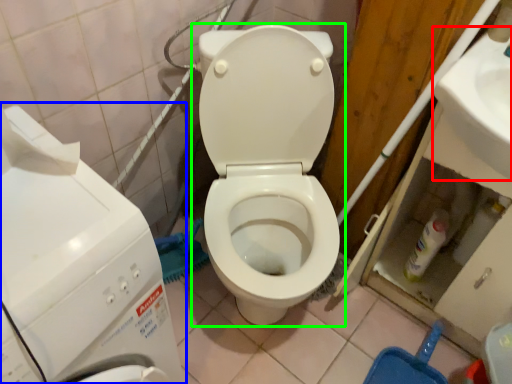
Question: Estimate the real-world distances between objects in this image. Which object is farther from sink (highlighted by a red box), washing machine (highlighted by a blue box) or toilet (highlighted by a green box)?

Choices:
 (A) washing machine
 (B) toilet

Answer: (A)